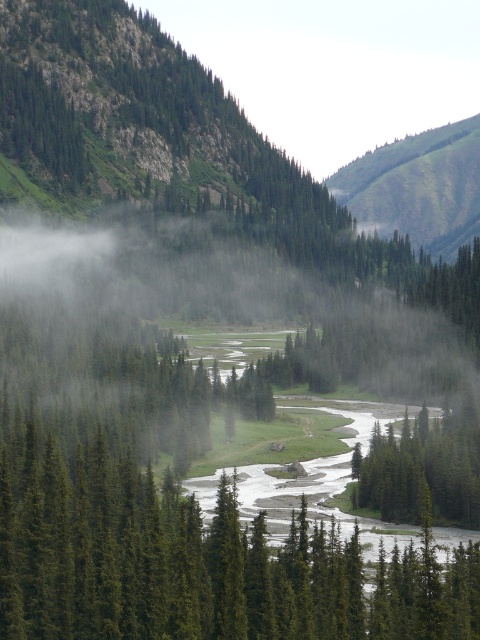
You are a hiker standing at the edge of the valley, and you want to reach the green matte tree at center. Given that your average walking speed is 1.5 meters per second, how long will it take you to walk straight to the tree?

The distance between you and the green matte tree at center is 43.14 meters. At a walking speed of 1.5 meters per second, the time required would be 43.14 divided by 1.5, which equals approximately 28.76 seconds. Therefore, it will take roughly 29 seconds to reach the tree.

You are an outdoor enthusiast planning a hiking route through the mountain landscape. You want to reach the green grassy hillside at upper right from the green matte tree at center. Based on the scene description, which direction should you head to ascend towards the hillside?

The green matte tree at center is positioned under the green grassy hillside at upper right, so you should head upwards from the green matte tree at center towards the green grassy hillside at upper right to ascend.

You are an environmental scientist assessing the forest health. You observe the green matte tree at center and the green matte tree at lower right. Which tree has a larger canopy width?

The green matte tree at center might be wider than the green matte tree at lower right, indicating it could have a larger canopy width.